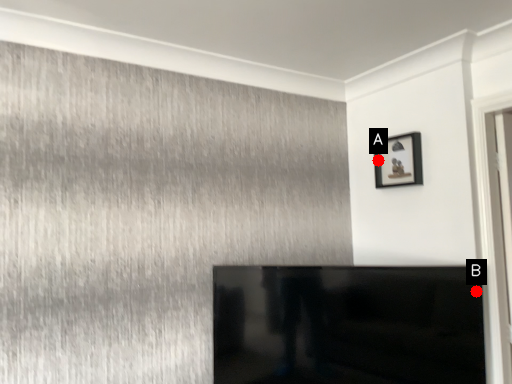
Question: Two points are circled on the image, labeled by A and B beside each circle. Which point is closer to the camera?

Choices:
 (A) A is closer
 (B) B is closer

Answer: (B)